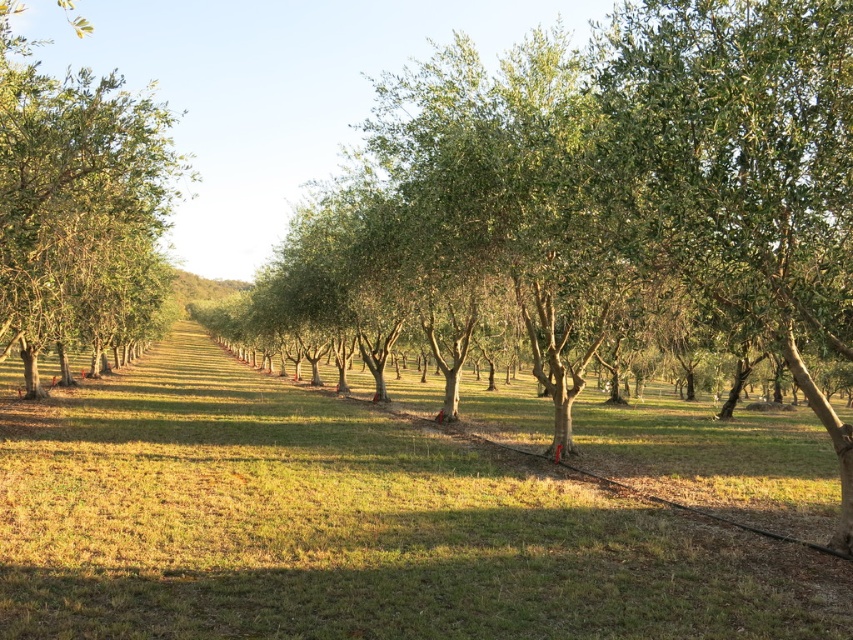
Identify the location of green leafy tree at center. This screenshot has height=640, width=853. (604, 198).

Can you confirm if green leafy tree at center is bigger than green leafy tree at left?

Yes.

Image resolution: width=853 pixels, height=640 pixels. What do you see at coordinates (604, 198) in the screenshot?
I see `green leafy tree at center` at bounding box center [604, 198].

Where is `green leafy tree at center`? The height and width of the screenshot is (640, 853). green leafy tree at center is located at coordinates (604, 198).

Can you confirm if green grass at center is taller than green leafy tree at center?

No.

The image size is (853, 640). I want to click on green grass at center, so (x=346, y=525).

At what (x,y) coordinates should I click in order to perform the action: click on green grass at center. Please return your answer as a coordinate pair (x, y). This screenshot has width=853, height=640. Looking at the image, I should click on (346, 525).

Where is `green grass at center`? green grass at center is located at coordinates (346, 525).